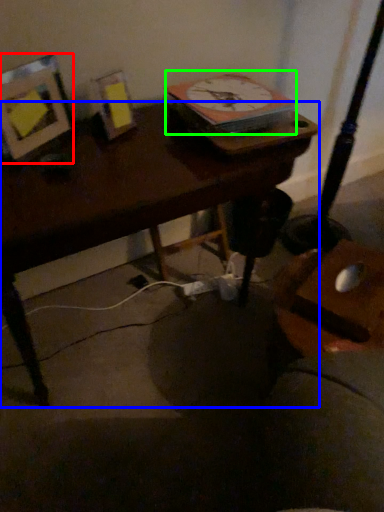
Question: Estimate the real-world distances between objects in this image. Which object is farther from picture frame (highlighted by a red box), desk (highlighted by a blue box) or clock (highlighted by a green box)?

Choices:
 (A) desk
 (B) clock

Answer: (B)